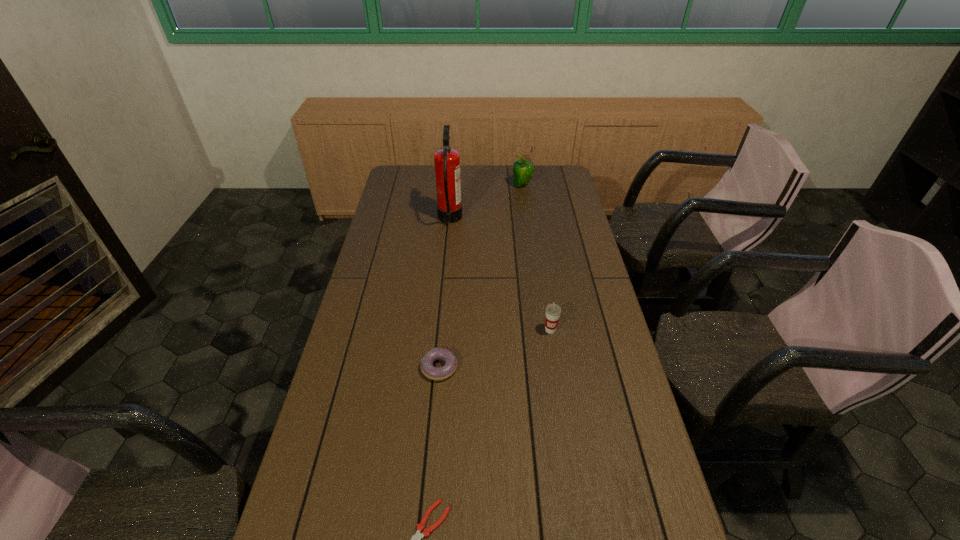
Locate an element on the screen. the tallest object is located at coordinates (447, 161).

I want to click on the fourth nearest object, so (447, 161).

At what (x,y) coordinates should I click in order to perform the action: click on the second tallest object. Please return your answer as a coordinate pair (x, y). Looking at the image, I should click on (523, 170).

Image resolution: width=960 pixels, height=540 pixels. I want to click on bell pepper, so click(x=523, y=170).

This screenshot has height=540, width=960. Find the location of `the third shortest object`. the third shortest object is located at coordinates (553, 311).

Image resolution: width=960 pixels, height=540 pixels. Find the location of `cup`. cup is located at coordinates (553, 311).

This screenshot has height=540, width=960. I want to click on the second nearest object, so click(x=434, y=373).

This screenshot has height=540, width=960. Identify the location of the second shortest object. (434, 373).

Find the location of a particular element. This screenshot has width=960, height=540. free space located 0.160m on the front-facing side of the fire extinguisher is located at coordinates pos(500,220).

The width and height of the screenshot is (960, 540). Find the location of `free space located 0.390m on the front of the second tallest object`. free space located 0.390m on the front of the second tallest object is located at coordinates (530, 241).